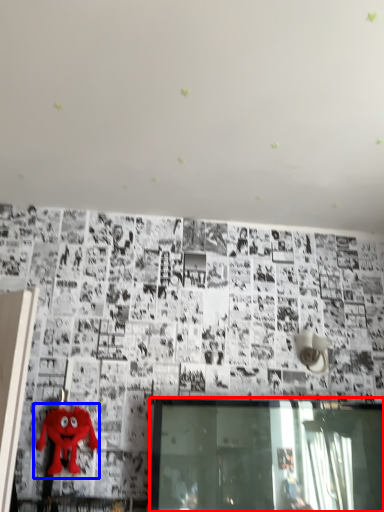
Question: Which object is further to the camera taking this photo, window (highlighted by a red box) or toy (highlighted by a blue box)?

Choices:
 (A) window
 (B) toy

Answer: (B)